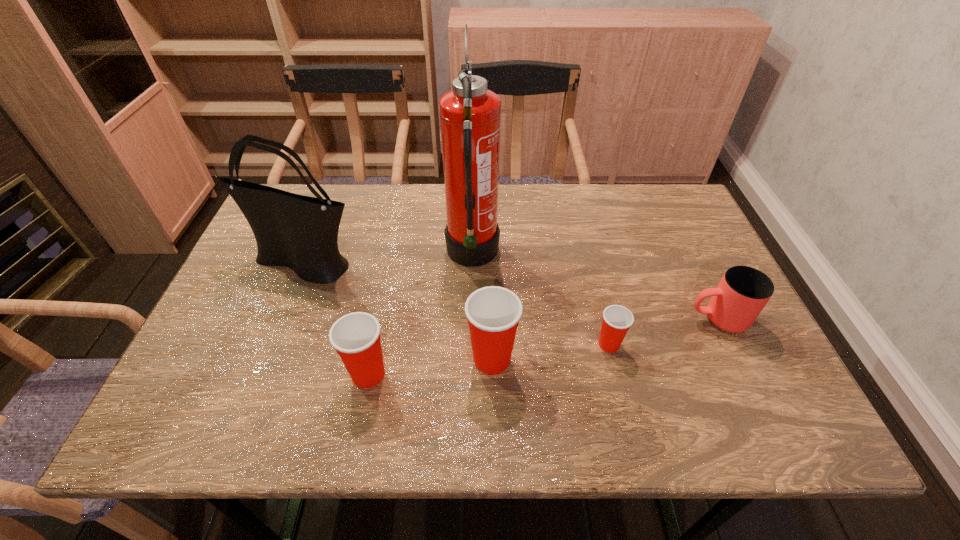
Image resolution: width=960 pixels, height=540 pixels. I want to click on free space located 0.150m on the back of the second tallest Dixie cup, so click(x=383, y=303).

Where is `free space located 0.130m on the right of the second Dixie cup from right to left`? The width and height of the screenshot is (960, 540). free space located 0.130m on the right of the second Dixie cup from right to left is located at coordinates (577, 359).

Locate an element on the screen. This screenshot has height=540, width=960. vacant space located on the back of the rightmost Dixie cup is located at coordinates (585, 246).

Locate an element on the screen. Image resolution: width=960 pixels, height=540 pixels. free space located on the back of the shoulder bag is located at coordinates (329, 204).

You are a GUI agent. You are given a task and a screenshot of the screen. Output one action in this format:
    pyautogui.click(x=<x>, y=<y>)
    Task: Click on the free space located on the front-facing side of the tallest object
    The height and width of the screenshot is (540, 960).
    Given the screenshot: What is the action you would take?
    pyautogui.click(x=611, y=256)

What are the coordinates of `free space located 0.130m on the handle side of the fifth tallest object` in the screenshot? It's located at (632, 319).

This screenshot has height=540, width=960. Identify the location of vacant space situated on the handle side of the fifth tallest object. (586, 319).

Identify the location of free space located on the handle side of the fifth tallest object. (586, 319).

Locate an element on the screen. The height and width of the screenshot is (540, 960). object positioned at the far edge is located at coordinates [x=470, y=115].

Identify the location of object situated at the left edge. The height and width of the screenshot is (540, 960). (300, 232).